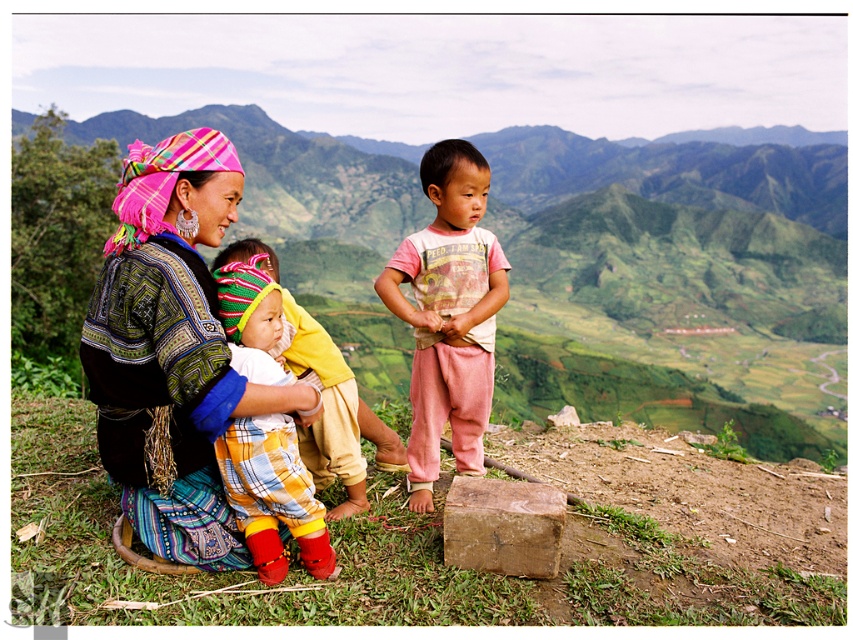
Question: Where is pink cotton pants at center located in relation to knitted woolen hat at center in the image?

Choices:
 (A) below
 (B) above

Answer: (B)

Question: Where is knitted woolen hat at center located in relation to brown rough stone at lower center in the image?

Choices:
 (A) below
 (B) above

Answer: (B)

Question: Among these objects, which one is nearest to the camera?

Choices:
 (A) matte black dress at center
 (B) pink cotton pants at center
 (C) knitted woolen hat at center

Answer: (A)

Question: Which point appears farthest from the camera in this image?

Choices:
 (A) (308, 545)
 (B) (473, 460)
 (C) (492, 493)
 (D) (206, 328)

Answer: (B)

Question: Which point is farther to the camera?

Choices:
 (A) (436, 161)
 (B) (515, 561)
 (C) (265, 582)

Answer: (A)

Question: Does knitted woolen hat at center come behind brown rough stone at lower center?

Choices:
 (A) yes
 (B) no

Answer: (B)